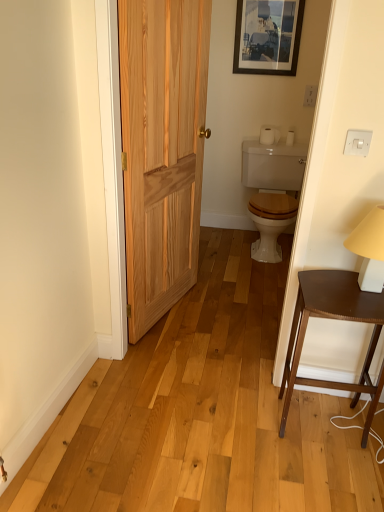
Question: Is natural wood door at left to the right of white matte table lamp at right from the viewer's perspective?

Choices:
 (A) yes
 (B) no

Answer: (B)

Question: From the image's perspective, does natural wood door at left appear lower than white matte table lamp at right?

Choices:
 (A) yes
 (B) no

Answer: (B)

Question: Considering the relative sizes of natural wood door at left and white matte table lamp at right in the image provided, is natural wood door at left taller than white matte table lamp at right?

Choices:
 (A) no
 (B) yes

Answer: (B)

Question: Considering the relative sizes of natural wood door at left and white matte table lamp at right in the image provided, is natural wood door at left bigger than white matte table lamp at right?

Choices:
 (A) no
 (B) yes

Answer: (B)

Question: From a real-world perspective, does natural wood door at left sit lower than white matte table lamp at right?

Choices:
 (A) yes
 (B) no

Answer: (B)

Question: Is dark brown wood table at right wider or thinner than wooden picture frame at upper center?

Choices:
 (A) wide
 (B) thin

Answer: (A)

Question: Is dark brown wood table at right situated inside wooden picture frame at upper center or outside?

Choices:
 (A) outside
 (B) inside

Answer: (A)

Question: Based on their sizes in the image, would you say dark brown wood table at right is bigger or smaller than wooden picture frame at upper center?

Choices:
 (A) small
 (B) big

Answer: (B)

Question: Is dark brown wood table at right taller or shorter than wooden picture frame at upper center?

Choices:
 (A) short
 (B) tall

Answer: (B)

Question: Would you say white matte toilet paper at upper center, which is the 1th toilet paper in left-to-right order, is to the left or to the right of wooden picture frame at upper center in the picture?

Choices:
 (A) right
 (B) left

Answer: (A)

Question: Is white matte toilet paper at upper center, which is the 1th toilet paper in left-to-right order, wider or thinner than wooden picture frame at upper center?

Choices:
 (A) thin
 (B) wide

Answer: (B)

Question: Is white matte toilet paper at upper center, which is the 1th toilet paper in left-to-right order, in front of or behind wooden picture frame at upper center in the image?

Choices:
 (A) front
 (B) behind

Answer: (B)

Question: Considering the positions of point (279, 135) and point (279, 38), is point (279, 135) closer or farther from the camera than point (279, 38)?

Choices:
 (A) closer
 (B) farther

Answer: (B)

Question: From the image's perspective, relative to white matte table lamp at right, is white matte toilet paper at upper right, which appears as the 2th toilet paper when viewed from the left, above or below?

Choices:
 (A) above
 (B) below

Answer: (A)

Question: Considering the positions of point (292, 130) and point (377, 216), is point (292, 130) closer or farther from the camera than point (377, 216)?

Choices:
 (A) farther
 (B) closer

Answer: (A)